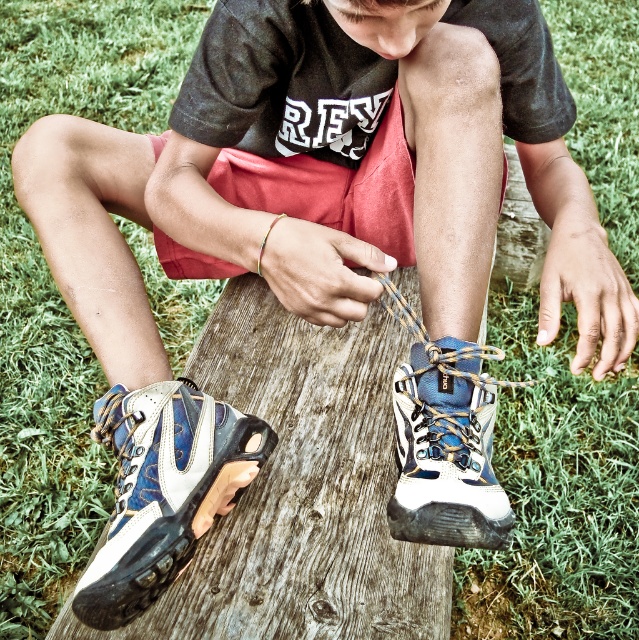
What is the exact location of the white leather sneaker at lower center in the image?

The white leather sneaker at lower center is located at point coordinates of 0.766 on the x axis and 0.257 on the y axis.

You are a photographer trying to capture the hiking boots in the image. You notice two points marked on the boots. Which point is closer to you, point (141,403) or point (404,509)?

Point (141,403) is closer to you than point (404,509).

You are standing at the point labeled point (155, 449) and want to toss a small pebble to a friend who is standing 40 inches away from you. Can you reach your friend with the toss?

The distance between you and your friend is 40 inches, but the point labeled point (155, 449) is only 35.00 inches away from the viewer. Therefore, you cannot reach your friend with the toss as it requires an extra 5 inches.